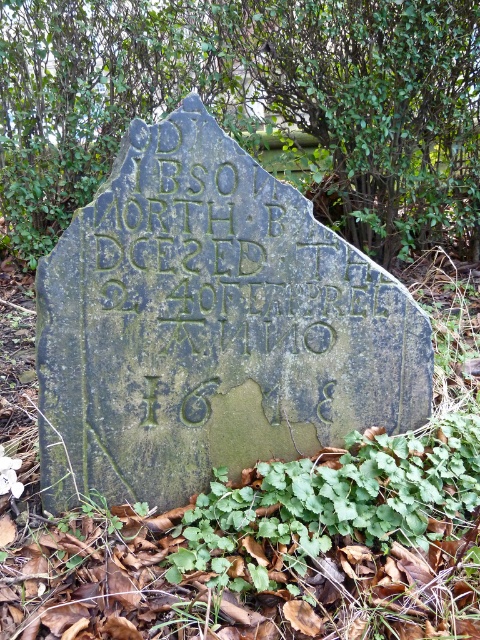
Who is more distant from viewer, (181, 124) or (369, 172)?

The point (369, 172) is behind.

Can you confirm if green mossy stone gravestone at center is thinner than green leafy tree at upper center?

Yes, green mossy stone gravestone at center is thinner than green leafy tree at upper center.

Between point (314, 333) and point (404, 232), which one is positioned behind?

The point (404, 232) is behind.

You are a GUI agent. You are given a task and a screenshot of the screen. Output one action in this format:
    pyautogui.click(x=<x>, y=<y>)
    Task: Click on the green mossy stone gravestone at center
    The image size is (480, 640).
    Given the screenshot: What is the action you would take?
    pyautogui.click(x=210, y=324)

Between green mossy stone gravestone at center and green leafy plant at lower center, which one has more height?

green mossy stone gravestone at center is taller.

Can you confirm if green mossy stone gravestone at center is positioned below green leafy plant at lower center?

Actually, green mossy stone gravestone at center is above green leafy plant at lower center.

Is point (140, 422) less distant than point (408, 433)?

That is True.

Find the location of `green mossy stone gravestone at center`. green mossy stone gravestone at center is located at coordinates (210, 324).

Who is more forward, (278,1) or (427,460)?

Point (427,460)

Between green leafy tree at upper center and green leafy plant at lower center, which one appears on the left side from the viewer's perspective?

green leafy tree at upper center

Who is more distant from viewer, (x=398, y=164) or (x=391, y=464)?

The point (x=398, y=164) is more distant.

The image size is (480, 640). In order to click on green leafy tree at upper center in this screenshot , I will do `click(250, 100)`.